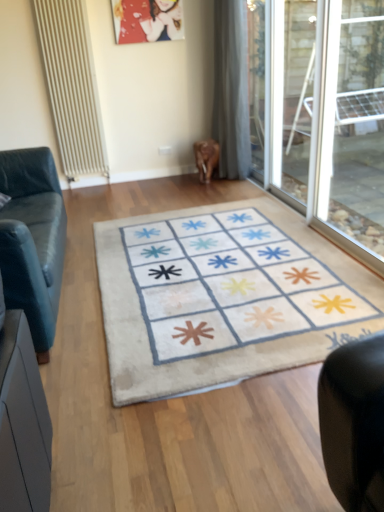
This screenshot has height=512, width=384. What are the coordinates of `free point below beige textured radiator at left (from a real-world perspective)` in the screenshot? It's located at (87, 185).